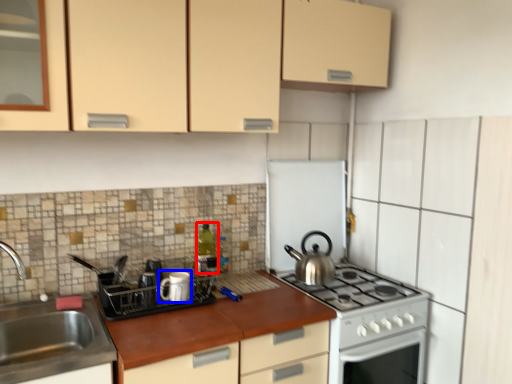
Question: Which object appears farthest to the camera in this image, bottle (highlighted by a red box) or appliance (highlighted by a blue box)?

Choices:
 (A) bottle
 (B) appliance

Answer: (A)